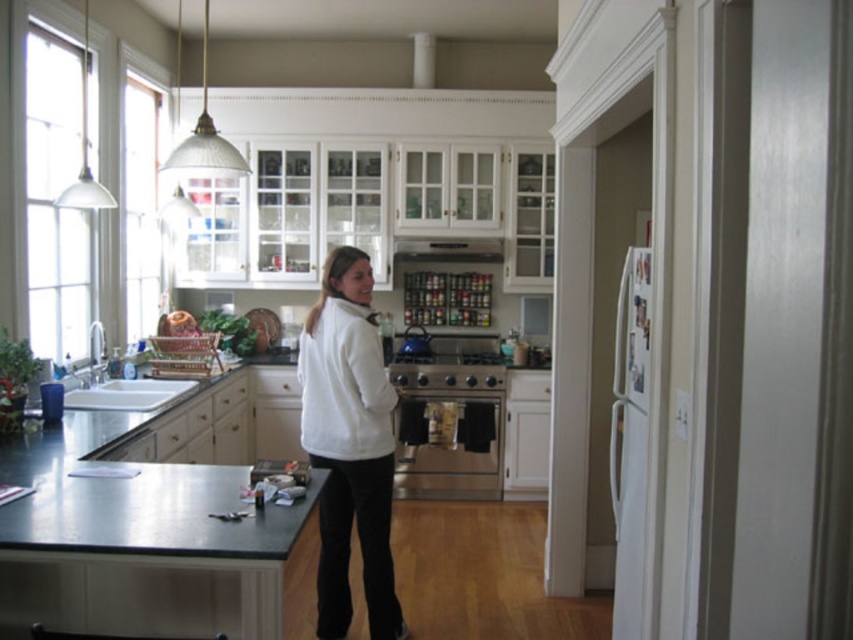
You are standing in the kitchen and want to take a photo of the point at coordinates (474, 452). If your camera can focus on objects within 15 feet, will you need to adjust your position?

The point at coordinates (474, 452) is 16.92 feet away from the camera, which is beyond the 15 feet focus range. You will need to move closer to ensure proper focus.

You are a home decorator planning to hang a new kitchen pendant light. You need to ensure it doesn not block the view of the white fleece sweater at center and the satin silver metal exhaust hood at upper center. Which object requires the pendant light to be hung higher to avoid blocking it?

The white fleece sweater at center is much taller than the satin silver metal exhaust hood at upper center, so the pendant light should be hung higher to avoid blocking the taller white fleece sweater at center.

You are standing at the point labeled point (x=646, y=300) in the kitchen. You want to walk to the point labeled point (x=456, y=355). Is this point in front of or behind you?

The point labeled point (x=456, y=355) is behind point (x=646, y=300), so it is behind you.